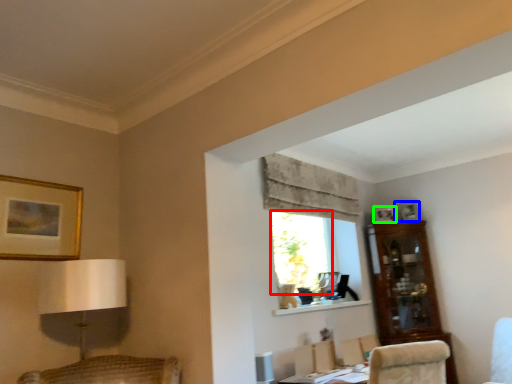
Question: Which object is the farthest from window (highlighted by a red box)? Choose among these: picture frame (highlighted by a blue box) or picture frame (highlighted by a green box).

Choices:
 (A) picture frame
 (B) picture frame

Answer: (A)